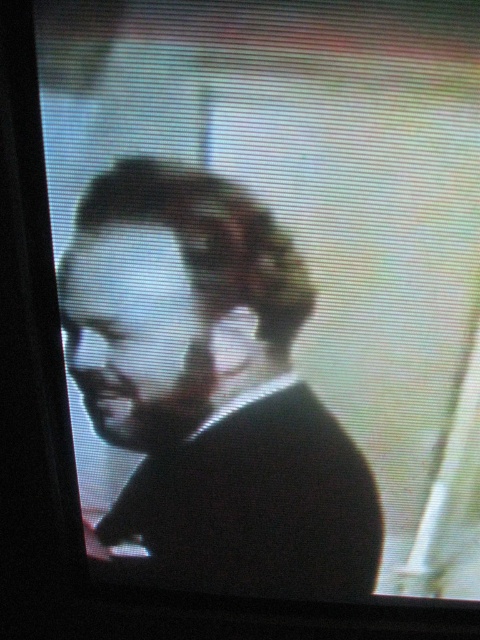
You are a fashion designer analyzing a TV show character. You notice the black matte suit at center and the matte black face at center. Which object occupies more vertical space on the screen?

The black matte suit at center is taller than matte black face at center, so the black matte suit at center occupies more vertical space on the screen.

You are a tailor measuring the distance between the black matte suit at center and the matte black face at center on a TV screen. The minimum required distance for accurate measurements is 6 centimeters. Can you proceed with the measurement?

The distance between the black matte suit at center and the matte black face at center is 6.22 centimeters, which exceeds the minimum requirement of 6 centimeters. Therefore, you can proceed with the measurement.

You are a fashion designer observing a TV screen showing a person wearing a black matte suit at center and a matte black face at center. Which object is located to the right of the other?

The black matte suit at center is positioned on the right side of matte black face at center.